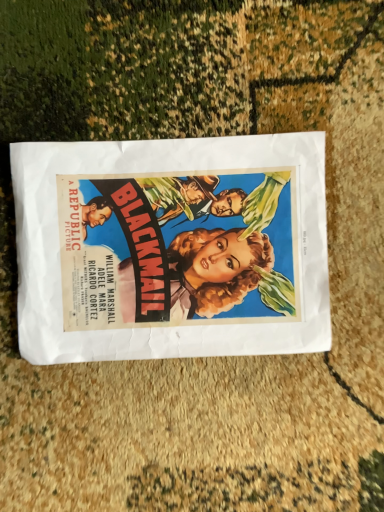
At what (x,y) coordinates should I click in order to perform the action: click on vacant area on top of vibrant paper poster at center (from a real-world perspective). Please return your answer as a coordinate pair (x, y). This screenshot has width=384, height=512. Looking at the image, I should click on (170, 246).